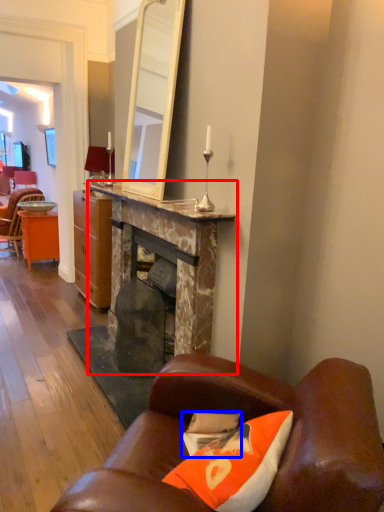
Question: Which point is further to the camera, table (highlighted by a red box) or pillow (highlighted by a blue box)?

Choices:
 (A) table
 (B) pillow

Answer: (A)